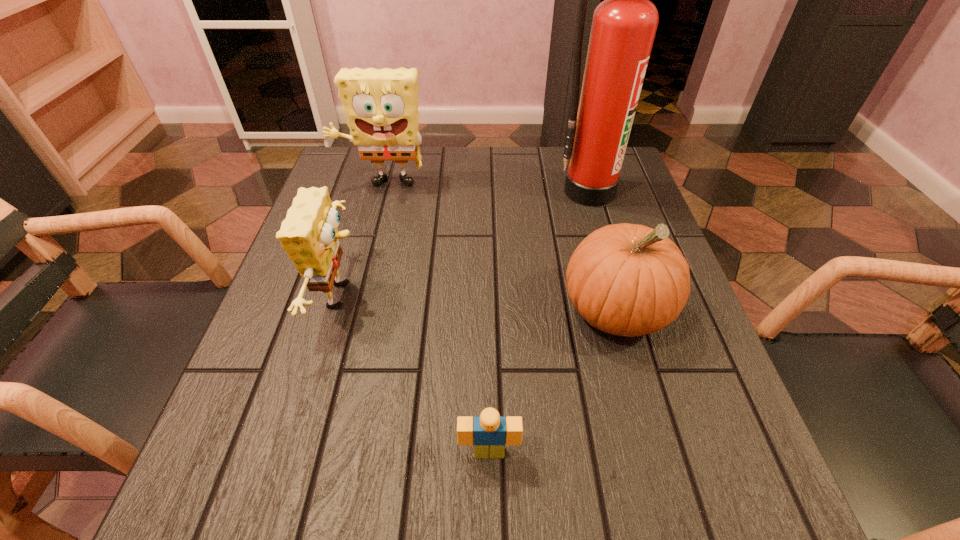
Where is `vacant area at the left edge`? The image size is (960, 540). vacant area at the left edge is located at coordinates (301, 285).

The height and width of the screenshot is (540, 960). Find the location of `free point at the right edge`. free point at the right edge is located at coordinates (609, 210).

You are a GUI agent. You are given a task and a screenshot of the screen. Output one action in this format:
    pyautogui.click(x=<x>, y=<y>)
    Task: Click on the vacant space at the far left corner of the desktop
    Image resolution: width=960 pixels, height=540 pixels.
    Given the screenshot: What is the action you would take?
    pyautogui.click(x=330, y=198)

The width and height of the screenshot is (960, 540). What are the coordinates of `free space that is in between the shorter sponge and the fire extinguisher` in the screenshot? It's located at (466, 243).

This screenshot has width=960, height=540. I want to click on vacant area that lies between the nearest object and the tallest object, so click(538, 321).

Where is `free space between the pumpkin and the taller sponge`? free space between the pumpkin and the taller sponge is located at coordinates (499, 248).

This screenshot has height=540, width=960. Identify the location of vacant space in between the nearer sponge and the fire extinguisher. (466, 243).

At what (x,y) coordinates should I click in order to perform the action: click on blank region between the fire extinguisher and the taller sponge. Please return your answer as a coordinate pair (x, y). Looking at the image, I should click on (485, 188).

I want to click on free space between the nearer sponge and the nearest object, so click(x=416, y=374).

Find the location of `free space between the tallest object and the nearer sponge`. free space between the tallest object and the nearer sponge is located at coordinates coord(466,243).